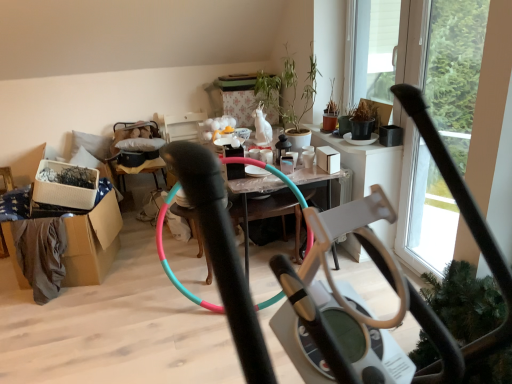
Question: From a real-world perspective, is wooden cushioned armchair at center-left positioned above or below white woven basket at left, the second box from the right?

Choices:
 (A) above
 (B) below

Answer: (B)

Question: Is wooden cushioned armchair at center-left wider or thinner than white woven basket at left, the 1th box positioned from the left?

Choices:
 (A) wide
 (B) thin

Answer: (A)

Question: Which of these objects is positioned closest to the white matte box at center, which is the 1th box from right to left?

Choices:
 (A) transparent glass window screen at upper right
 (B) green matte plant at upper center
 (C) white woven basket at left, the 1th box positioned from the left
 (D) brown cardboard box at left
 (E) matte black pot at upper right

Answer: (E)

Question: Considering the real-world distances, which object is closest to the matte black pot at upper right?

Choices:
 (A) white matte box at center, which is the 1th box from right to left
 (B) white woven basket at left, the second box from the right
 (C) transparent glass window screen at upper right
 (D) green matte plant at upper center
 (E) translucent plastic table at center

Answer: (A)